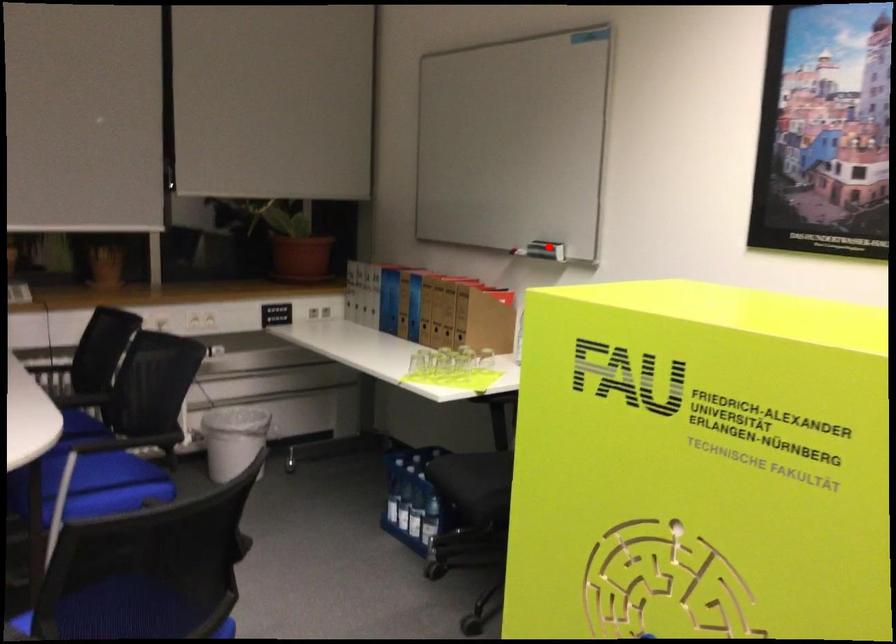
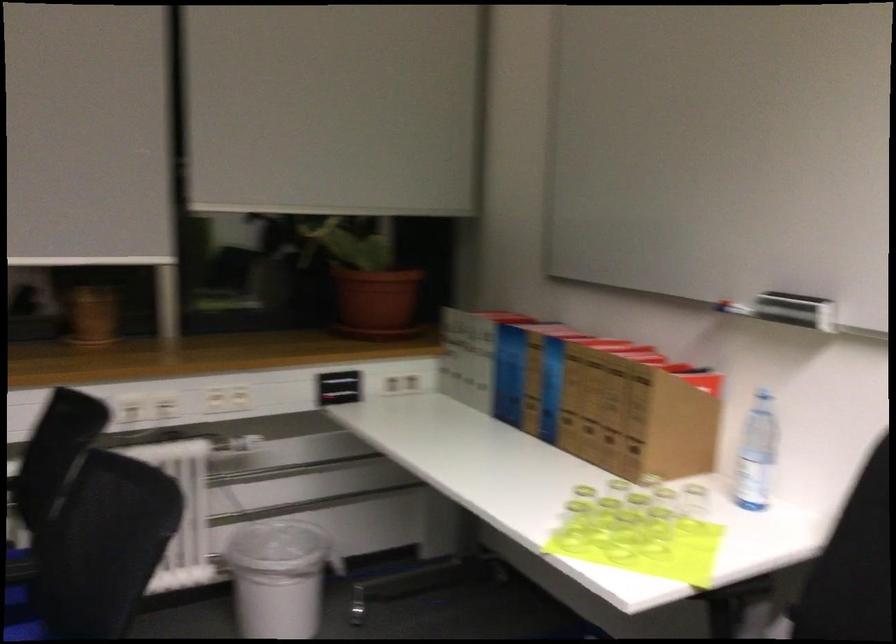
Question: I am providing you with two images of the same scene from different viewpoints. Image1 has a red point marked. In image2, the corresponding 3D location appears at what relative position? Reply with the corresponding letter.

Choices:
 (A) Closer
 (B) Farther

Answer: (A)